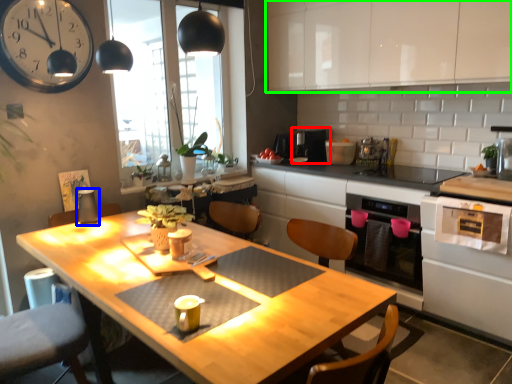
Question: Estimate the real-world distances between objects in this image. Which object is farther from appliance (highlighted by a red box), appliance (highlighted by a blue box) or cabinetry (highlighted by a green box)?

Choices:
 (A) appliance
 (B) cabinetry

Answer: (A)